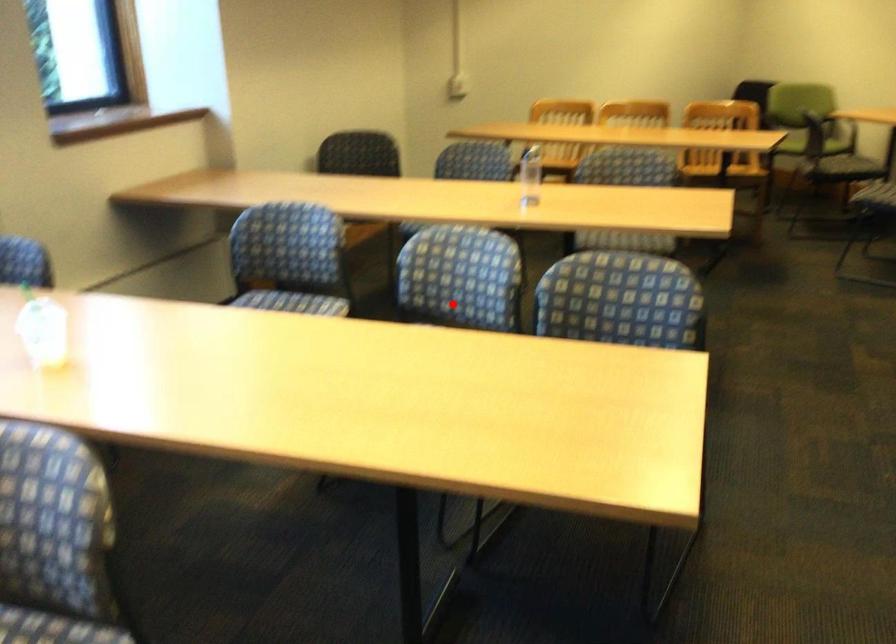
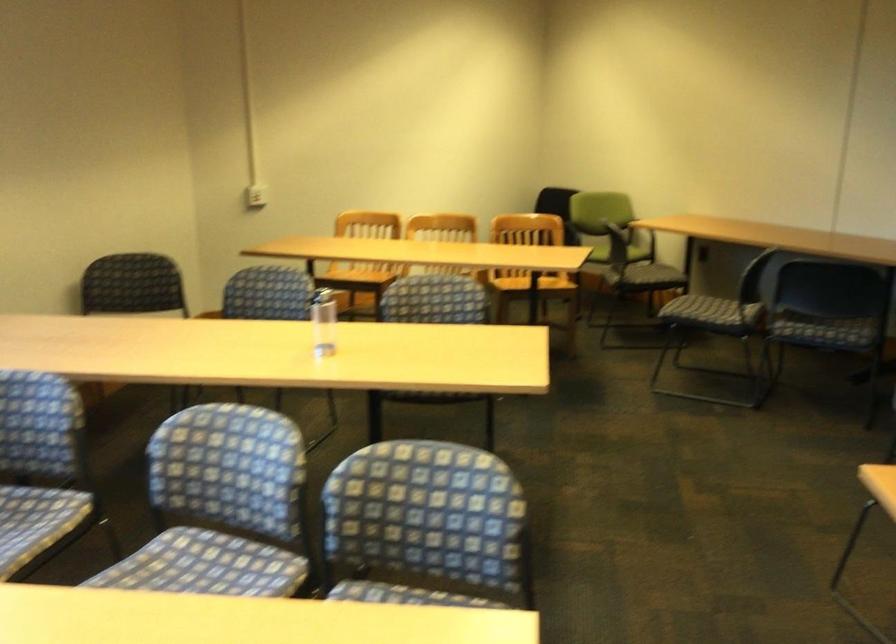
Question: I am providing you with two images of the same scene from different viewpoints. Given a red point in image1, look at the same physical point in image2. Is it:

Choices:
 (A) Closer to the viewpoint
 (B) Farther from the viewpoint

Answer: (A)